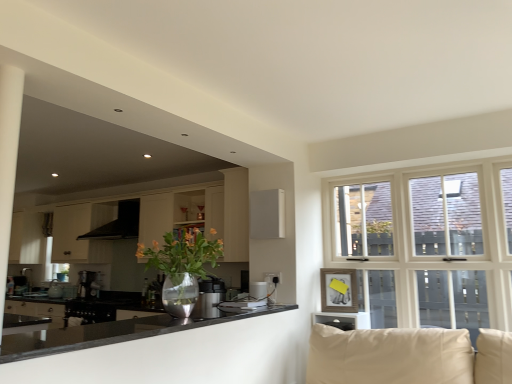
Question: Is black matte exhaust hood at upper left positioned beyond the bounds of black glossy countertop at lower left?

Choices:
 (A) no
 (B) yes

Answer: (B)

Question: From a real-world perspective, is black matte exhaust hood at upper left positioned over black glossy countertop at lower left based on gravity?

Choices:
 (A) no
 (B) yes

Answer: (B)

Question: Does black matte exhaust hood at upper left have a smaller size compared to black glossy countertop at lower left?

Choices:
 (A) no
 (B) yes

Answer: (A)

Question: Considering the relative positions of black matte exhaust hood at upper left and black glossy countertop at lower left in the image provided, is black matte exhaust hood at upper left to the left of black glossy countertop at lower left from the viewer's perspective?

Choices:
 (A) yes
 (B) no

Answer: (A)

Question: Can you confirm if black matte exhaust hood at upper left is bigger than black glossy countertop at lower left?

Choices:
 (A) yes
 (B) no

Answer: (A)

Question: Is matte wood cabinet at center, which is the second cabinetry from back to front, in front of or behind white matte cabinet at left, the second cabinetry in the right-to-left sequence, in the image?

Choices:
 (A) front
 (B) behind

Answer: (A)

Question: From their relative heights in the image, would you say matte wood cabinet at center, which ranks as the 1th cabinetry in right-to-left order, is taller or shorter than white matte cabinet at left, the second cabinetry in the right-to-left sequence?

Choices:
 (A) short
 (B) tall

Answer: (B)

Question: Looking at the image, does matte wood cabinet at center, which is the second cabinetry from back to front, seem bigger or smaller compared to white matte cabinet at left, the 2th cabinetry when ordered from front to back?

Choices:
 (A) big
 (B) small

Answer: (B)

Question: From a real-world perspective, relative to white matte cabinet at left, the first cabinetry when ordered from left to right, is matte wood cabinet at center, positioned as the 2th cabinetry in left-to-right order, vertically above or below?

Choices:
 (A) below
 (B) above

Answer: (A)

Question: Is black matte exhaust hood at upper left bigger or smaller than satin silver coffee machine at left?

Choices:
 (A) big
 (B) small

Answer: (A)

Question: Relative to satin silver coffee machine at left, is black matte exhaust hood at upper left in front or behind?

Choices:
 (A) behind
 (B) front

Answer: (B)

Question: Considering the positions of point (136, 200) and point (93, 289), is point (136, 200) closer or farther from the camera than point (93, 289)?

Choices:
 (A) closer
 (B) farther

Answer: (A)

Question: Considering the positions of black matte exhaust hood at upper left and satin silver coffee machine at left in the image, is black matte exhaust hood at upper left wider or thinner than satin silver coffee machine at left?

Choices:
 (A) wide
 (B) thin

Answer: (A)

Question: Looking at their shapes, would you say satin silver kettle at center is wider or thinner than black glossy countertop at lower left?

Choices:
 (A) thin
 (B) wide

Answer: (A)

Question: From their relative heights in the image, would you say satin silver kettle at center is taller or shorter than black glossy countertop at lower left?

Choices:
 (A) tall
 (B) short

Answer: (A)